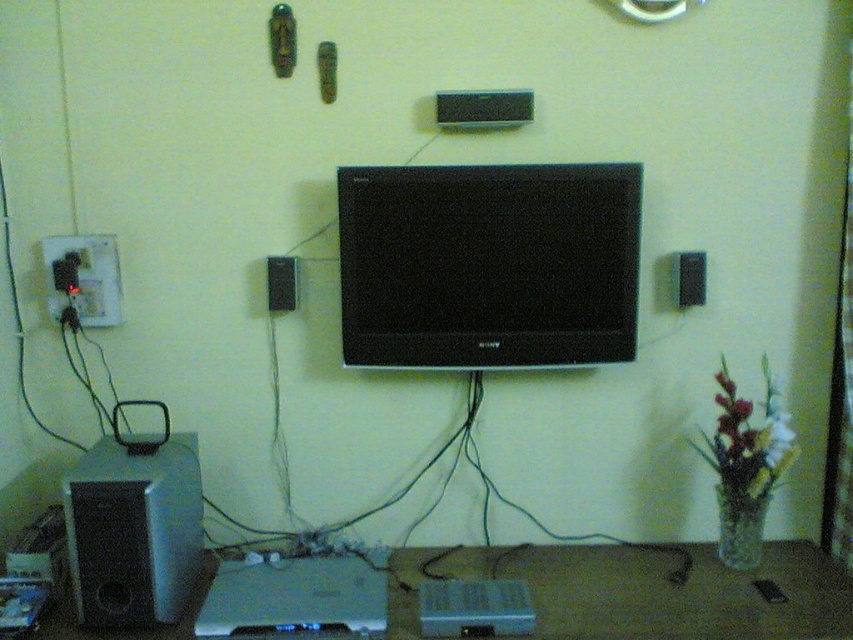
Question: Where is black plastic plug at left located in relation to black plastic speaker at upper center in the image?

Choices:
 (A) above
 (B) below

Answer: (A)

Question: Is silver metallic speaker at lower left bigger than black plastic speaker at upper center?

Choices:
 (A) yes
 (B) no

Answer: (A)

Question: Which object appears farthest from the camera in this image?

Choices:
 (A) black matte speaker at upper center
 (B) black plastic plug at left
 (C) black plastic speaker at upper center

Answer: (B)

Question: Among these objects, which one is farthest from the camera?

Choices:
 (A) black matte speaker at upper center
 (B) black plastic plug at left
 (C) silver metallic speaker at lower left
 (D) brown wooden table at lower center

Answer: (B)

Question: Can you confirm if black glossy flat screen tv at center is positioned below black plastic speaker at upper center?

Choices:
 (A) no
 (B) yes

Answer: (A)

Question: Estimate the real-world distances between objects in this image. Which object is farther from the black glossy flat screen tv at center?

Choices:
 (A) brown wooden table at lower center
 (B) black plastic plug at left

Answer: (B)